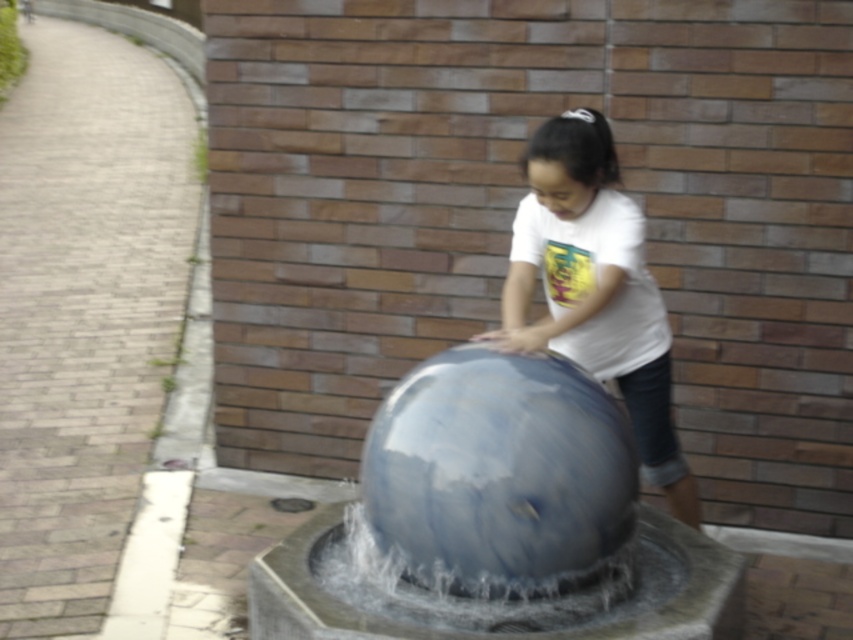
Question: Does transparent glass water at center appear under white glossy shirt at upper center?

Choices:
 (A) no
 (B) yes

Answer: (B)

Question: Which object is closer to the camera taking this photo?

Choices:
 (A) transparent glass water at center
 (B) white glossy shirt at upper center
 (C) shiny metallic sphere at center

Answer: (C)

Question: Does transparent glass water at center appear on the right side of white glossy shirt at upper center?

Choices:
 (A) no
 (B) yes

Answer: (A)

Question: Is the position of transparent glass water at center less distant than that of white glossy shirt at upper center?

Choices:
 (A) yes
 (B) no

Answer: (A)

Question: Estimate the real-world distances between objects in this image. Which object is farther from the transparent glass water at center?

Choices:
 (A) white glossy shirt at upper center
 (B) shiny metallic sphere at center

Answer: (A)

Question: Which of these objects is positioned farthest from the shiny metallic sphere at center?

Choices:
 (A) white glossy shirt at upper center
 (B) transparent glass water at center

Answer: (A)